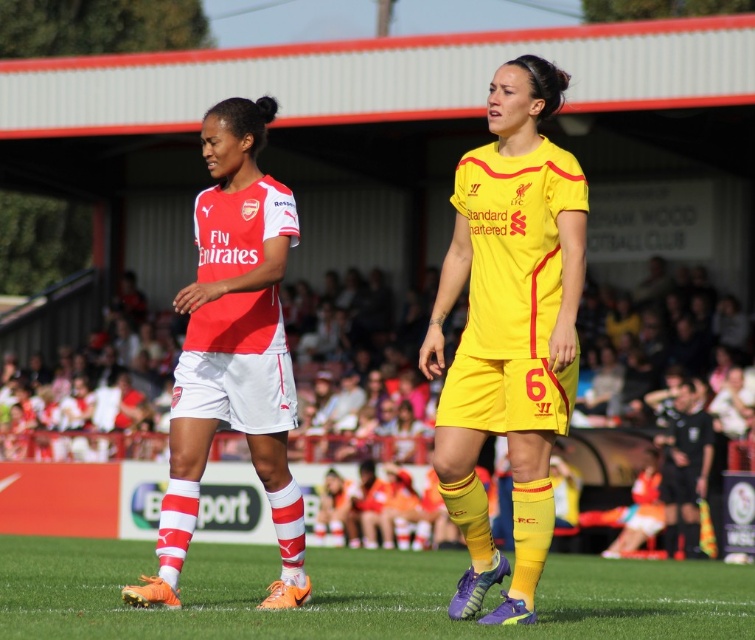
How much distance is there between yellow matte jersey at center and matte red and white jersey at center?

yellow matte jersey at center is 1.72 meters away from matte red and white jersey at center.

Between point (547, 115) and point (214, 138), which one is positioned behind?

The point (214, 138) is more distant.

In order to click on yellow matte jersey at center in this screenshot , I will do `click(509, 328)`.

Describe the element at coordinates (509, 328) in the screenshot. I see `yellow matte jersey at center` at that location.

Between yellow matte jersey at center and green grass at center, which one has less height?

With less height is green grass at center.

Locate an element on the screen. The height and width of the screenshot is (640, 755). yellow matte jersey at center is located at coordinates (509, 328).

The width and height of the screenshot is (755, 640). I want to click on yellow matte jersey at center, so coord(509,328).

Can you confirm if green grass at center is positioned to the left of matte red and white jersey at center?

No, green grass at center is not to the left of matte red and white jersey at center.

At what (x,y) coordinates should I click in order to perform the action: click on green grass at center. Please return your answer as a coordinate pair (x, y). This screenshot has height=640, width=755. Looking at the image, I should click on click(356, 595).